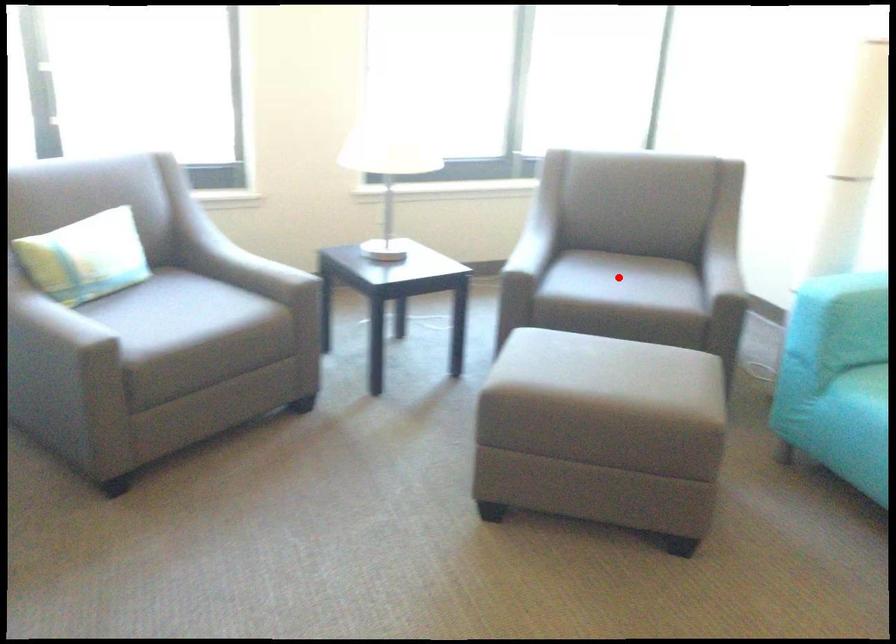
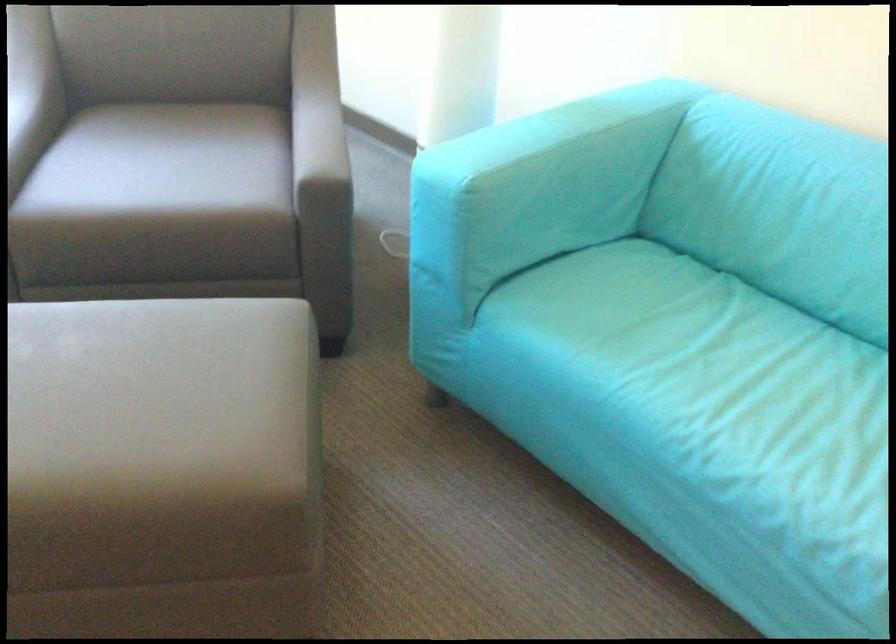
Question: I am providing you with two images of the same scene from different viewpoints. Image1 has a red point marked. In image2, the corresponding 3D location appears at what relative position? Reply with the corresponding letter.

Choices:
 (A) Closer
 (B) Farther

Answer: (A)